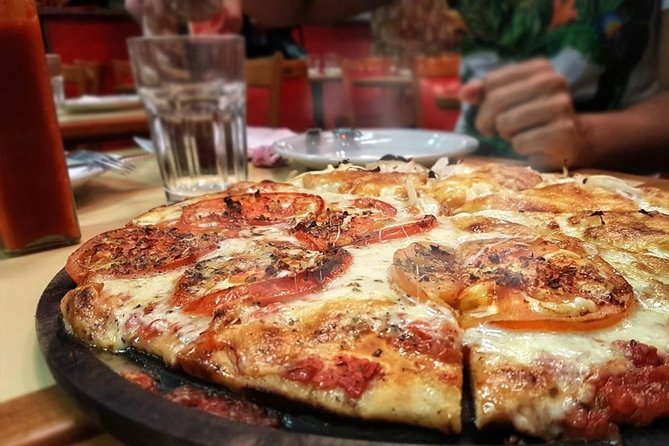
Locate an element on the screen. The image size is (669, 446). table is located at coordinates (100, 199), (25, 277).